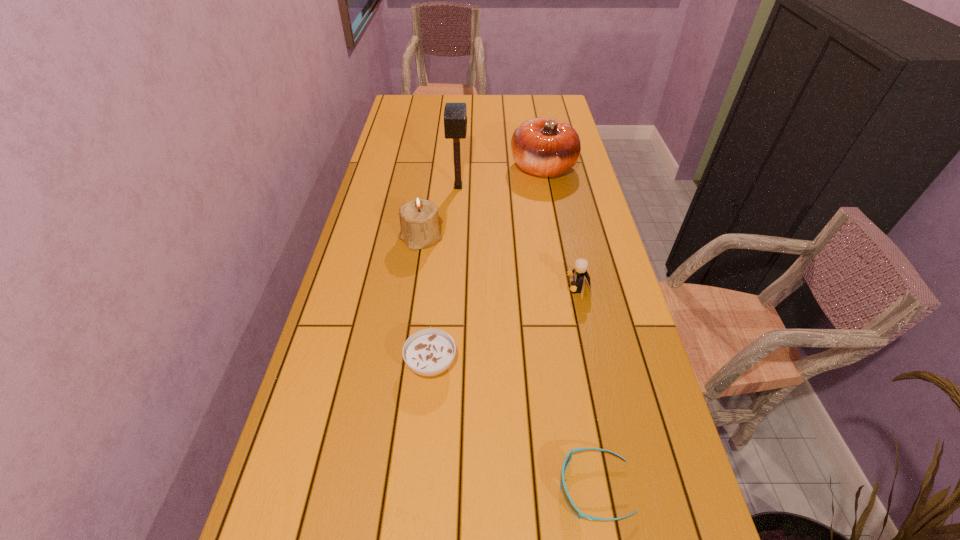
The image size is (960, 540). In order to click on free point located 0.280m on the left of the pumpkin in this screenshot , I will do `click(436, 168)`.

Find the location of a particular element. Image resolution: width=960 pixels, height=540 pixels. free space located on the right of the candle_holder is located at coordinates (558, 238).

Find the location of a particular element. The image size is (960, 540). vacant area situated 0.110m on the front-facing side of the third shortest object is located at coordinates (527, 288).

Identify the location of vacant space located 0.190m on the front-facing side of the third shortest object. The height and width of the screenshot is (540, 960). (498, 288).

Locate an element on the screen. This screenshot has width=960, height=540. vacant area situated on the front-facing side of the third shortest object is located at coordinates (467, 288).

At what (x,y) coordinates should I click in order to perform the action: click on free location located on the right of the second nearest object. Please return your answer as a coordinate pair (x, y). The width and height of the screenshot is (960, 540). Looking at the image, I should click on (512, 363).

At what (x,y) coordinates should I click in order to perform the action: click on vacant area situated 0.400m on the front-facing side of the sunglasses. Please return your answer as a coordinate pair (x, y). The height and width of the screenshot is (540, 960). Looking at the image, I should click on (350, 488).

Find the location of a particular element. free space located 0.390m on the front-facing side of the sunglasses is located at coordinates (355, 488).

Identify the location of vacant space located on the front-facing side of the sunglasses. The width and height of the screenshot is (960, 540). (361, 488).

In order to click on object that is at the left edge in this screenshot , I will do `click(419, 222)`.